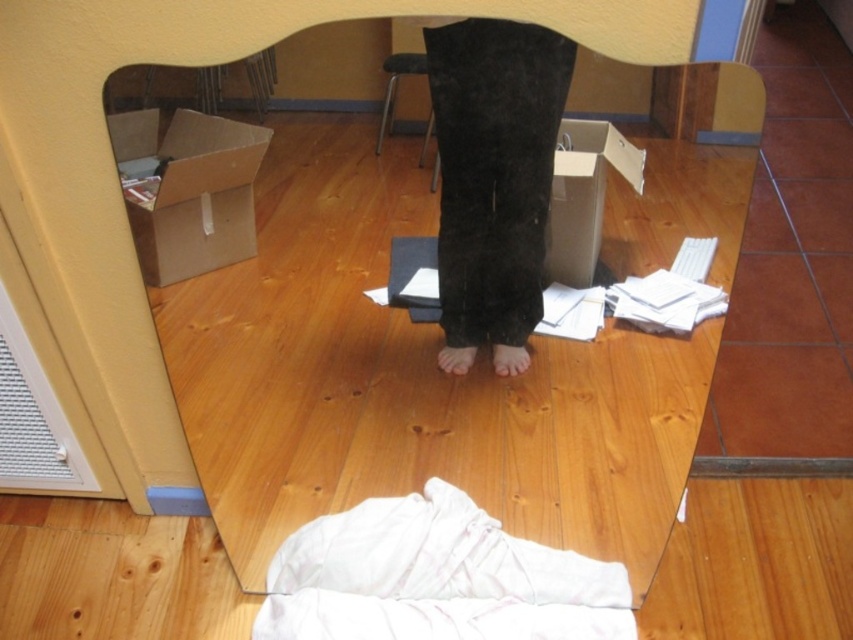
You are organizing a storage space and need to place both the brown cardboard box at left and the metallic silver stool at center into a shelf. The shelf has a height limit of 1 meter. Given their sizes, can both items be placed on the shelf without exceeding the height limit?

The brown cardboard box at left is much taller than the metallic silver stool at center. Since the shelf has a height limit of 1 meter, we need to know the exact height of the taller item. However, since the box is taller, if it exceeds 1 meter, both cannot fit. If the box is under 1 meter, both can fit. But without specific measurements, we can only say the box might be too tall.

Based on the photo, you are organizing items in a room with a mirror. You need to place a decorative item on the closest object to you between the brown cardboard box at left and the pink matte skin at center. Which object should you choose?

The brown cardboard box at left is closer to the viewer than the pink matte skin at center, so you should place the decorative item on the brown cardboard box at left.